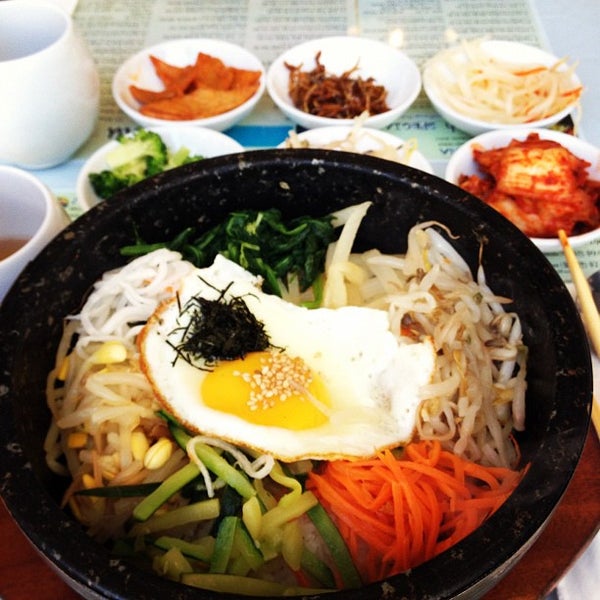
Locate an element on the screen. Image resolution: width=600 pixels, height=600 pixels. lagre bowl is located at coordinates coord(504,541).